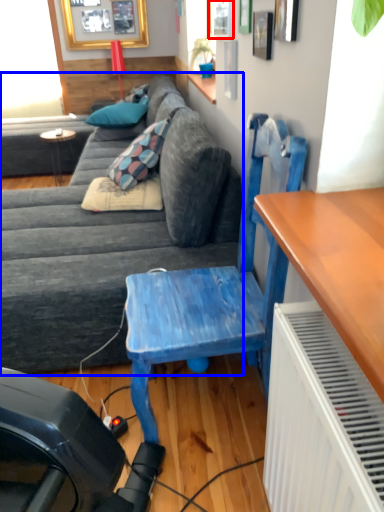
Question: Which point is closer to the camera, window (highlighted by a red box) or studio couch (highlighted by a blue box)?

Choices:
 (A) window
 (B) studio couch

Answer: (B)